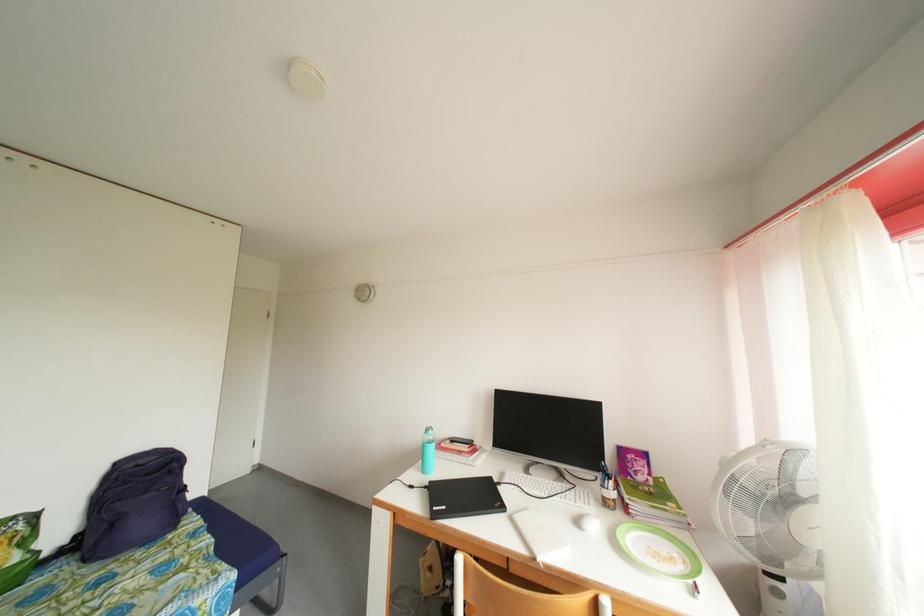
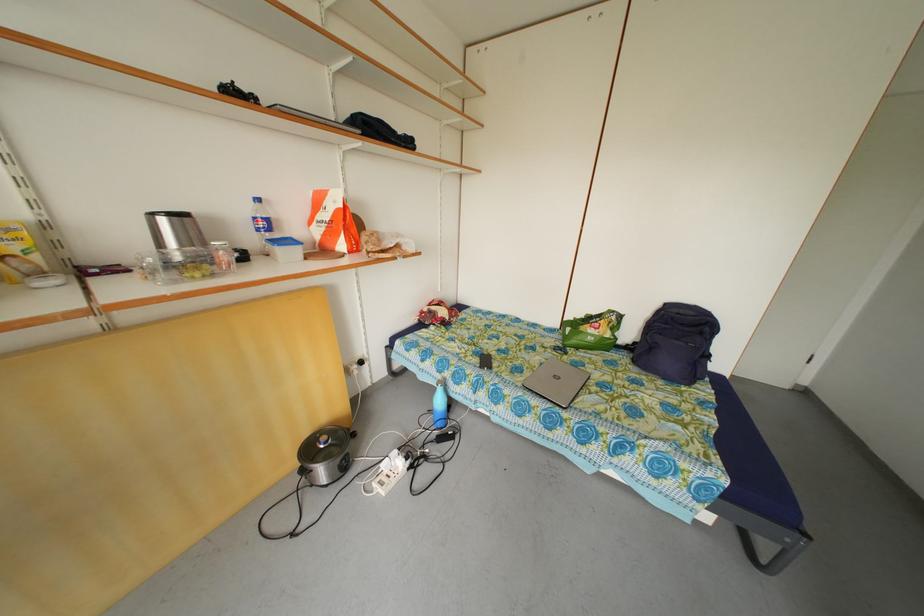
The first image is from the beginning of the video and the second image is from the end. How did the camera likely rotate when shooting the video?

The camera rotated toward left-down.